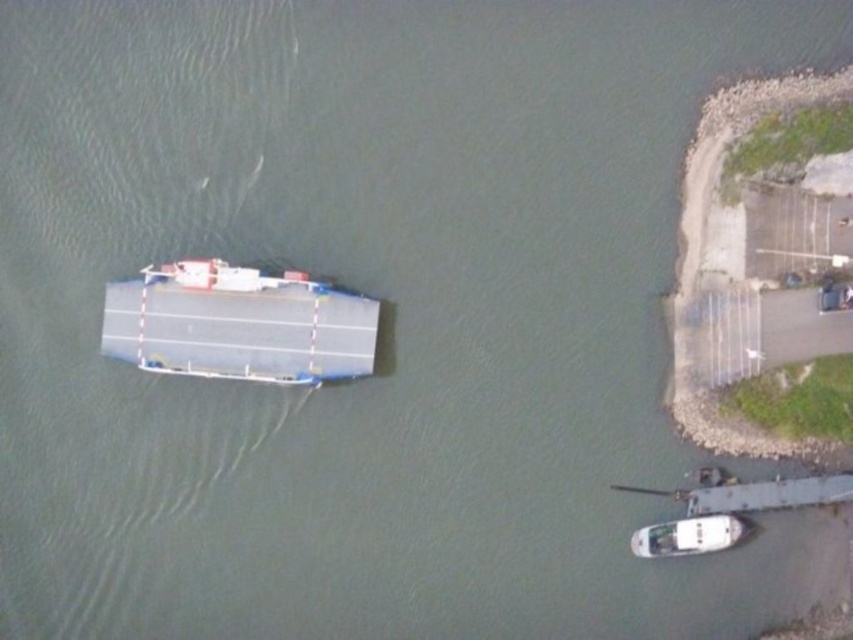
Does white glossy boat at center-left have a greater width compared to white glossy boat at lower right?

Yes, white glossy boat at center-left is wider than white glossy boat at lower right.

Who is more distant from viewer, (x=372, y=344) or (x=711, y=515)?

The point (x=711, y=515) is more distant.

I want to click on white glossy boat at center-left, so click(x=238, y=323).